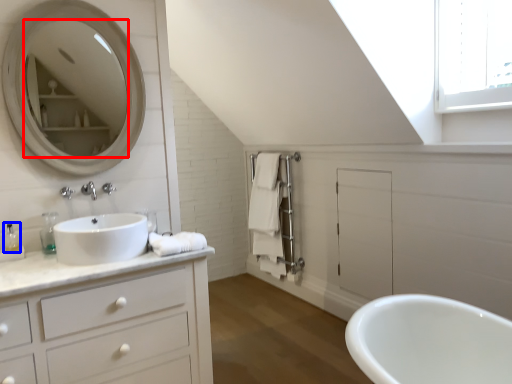
Question: Among these objects, which one is farthest to the camera, mirror (highlighted by a red box) or toiletry (highlighted by a blue box)?

Choices:
 (A) mirror
 (B) toiletry

Answer: (B)